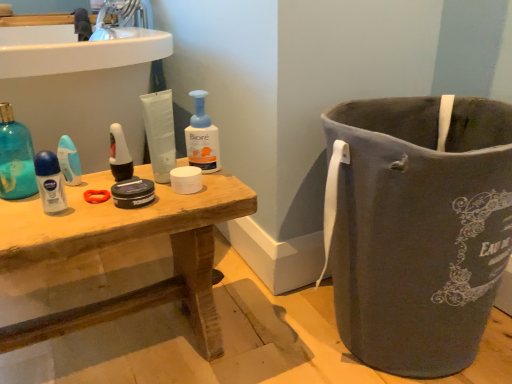
Question: From the image's perspective, is white matte toothbrush at center on top of wooden table at center?

Choices:
 (A) yes
 (B) no

Answer: (A)

Question: Would you say wooden table at center is part of white matte toothbrush at center's contents?

Choices:
 (A) no
 (B) yes

Answer: (A)

Question: Is white matte toothbrush at center further to the viewer compared to wooden table at center?

Choices:
 (A) no
 (B) yes

Answer: (B)

Question: Considering the relative sizes of white matte toothbrush at center and wooden table at center in the image provided, is white matte toothbrush at center bigger than wooden table at center?

Choices:
 (A) yes
 (B) no

Answer: (B)

Question: Would you say white matte toothbrush at center is a long distance from wooden table at center?

Choices:
 (A) yes
 (B) no

Answer: (B)

Question: In terms of width, does white matte toilet paper at center look wider or thinner when compared to white glossy sink at upper left?

Choices:
 (A) wide
 (B) thin

Answer: (B)

Question: Is white matte toilet paper at center inside the boundaries of white glossy sink at upper left, or outside?

Choices:
 (A) outside
 (B) inside

Answer: (A)

Question: Would you say white matte toilet paper at center is to the left or to the right of white glossy sink at upper left in the picture?

Choices:
 (A) right
 (B) left

Answer: (A)

Question: Is white matte toilet paper at center bigger or smaller than white glossy sink at upper left?

Choices:
 (A) small
 (B) big

Answer: (A)

Question: From a real-world perspective, is matte white shaving cream at left above or below white glossy sink at upper left?

Choices:
 (A) above
 (B) below

Answer: (B)

Question: Considering the positions of point (65, 208) and point (46, 24), is point (65, 208) closer or farther from the camera than point (46, 24)?

Choices:
 (A) closer
 (B) farther

Answer: (A)

Question: Is matte white shaving cream at left taller or shorter than white glossy sink at upper left?

Choices:
 (A) tall
 (B) short

Answer: (B)

Question: From the image's perspective, is matte white shaving cream at left positioned above or below white glossy sink at upper left?

Choices:
 (A) below
 (B) above

Answer: (A)

Question: Considering the positions of wooden table at center and translucent plastic deodorant stick at left, which ranks as the 2th cleaning product in right-to-left order, in the image, is wooden table at center wider or thinner than translucent plastic deodorant stick at left, which ranks as the 2th cleaning product in right-to-left order,?

Choices:
 (A) thin
 (B) wide

Answer: (B)

Question: Considering the relative positions of wooden table at center and translucent plastic deodorant stick at left, which ranks as the 1th cleaning product in left-to-right order, in the image provided, is wooden table at center to the left or to the right of translucent plastic deodorant stick at left, which ranks as the 1th cleaning product in left-to-right order,?

Choices:
 (A) right
 (B) left

Answer: (A)